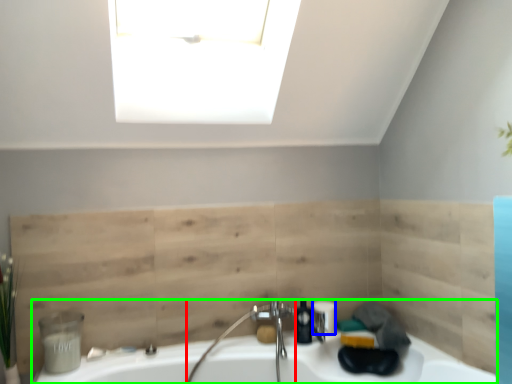
Question: Which object is the closest to the faucet (highlighted by a red box)? Choose among these: toiletry (highlighted by a blue box) or sink (highlighted by a green box).

Choices:
 (A) toiletry
 (B) sink

Answer: (B)